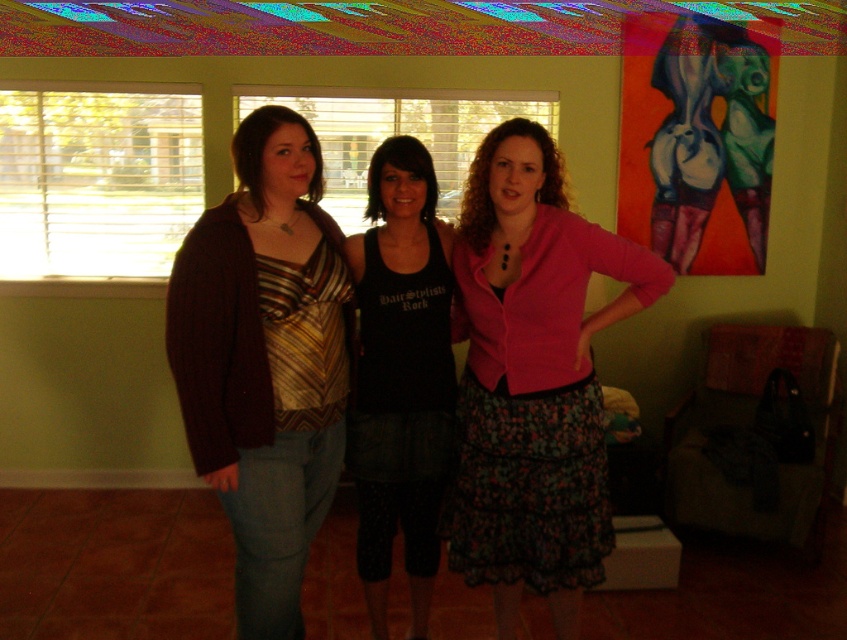
You are a photographer setting up a shoot in the room described. You notice the pink matte cardigan at center and the black tank top at center. Which clothing item is closer to the camera lens?

The pink matte cardigan at center is in front of the black tank top at center, so it is closer to the camera lens.

You are a photographer setting up a shoot in this room. You need to position a spotlight so that it illuminates both the matte brown cardigan at center and the black tank top at center without overlapping their light areas. Given that the window provides natural light from the right side, where should you place the spotlight relative to the two subjects?

The matte brown cardigan at center is positioned on the left side of the black tank top at center. To avoid overlapping light areas and utilize the natural light from the right, place the spotlight to the left of the matte brown cardigan at center so that it illuminates both subjects from opposite directions.